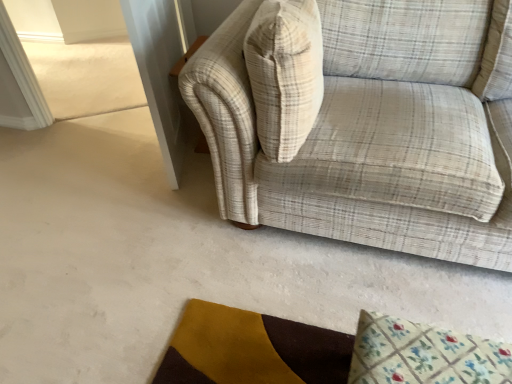
This screenshot has height=384, width=512. I want to click on vacant space that is in between plaid fabric couch at upper right and floral fabric mat at lower right, so click(335, 298).